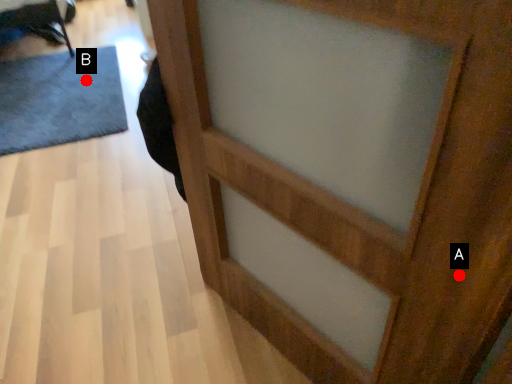
Question: Two points are circled on the image, labeled by A and B beside each circle. Which point is closer to the camera?

Choices:
 (A) A is closer
 (B) B is closer

Answer: (A)